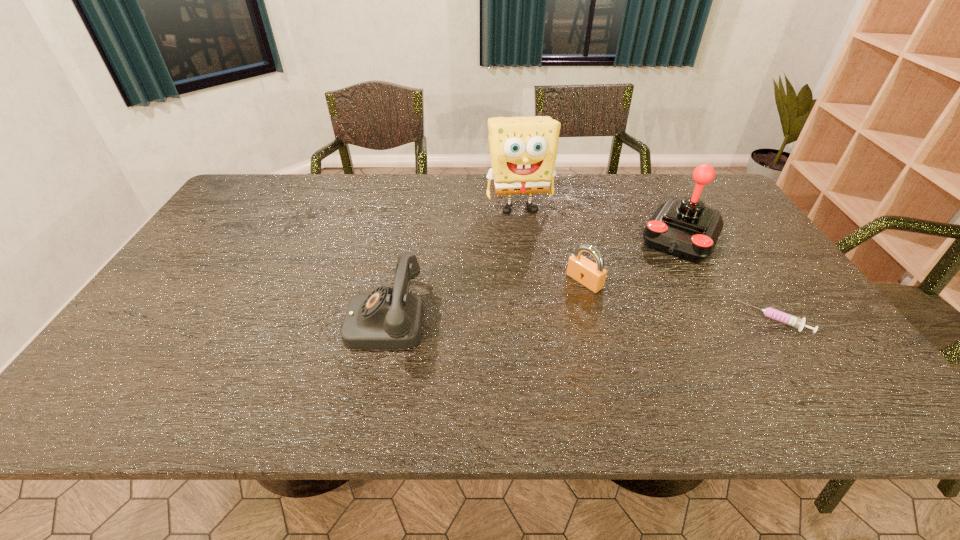
Locate an element on the screen. This screenshot has width=960, height=540. blank space located on the face of the tallest object is located at coordinates (545, 298).

What are the coordinates of `vacant area situated 0.330m on the face of the tallest object` in the screenshot? It's located at (544, 295).

You are a GUI agent. You are given a task and a screenshot of the screen. Output one action in this format:
    pyautogui.click(x=<x>, y=<y>)
    Task: Click on the vacant space located 0.070m on the face of the tallest object
    This screenshot has height=540, width=960.
    Given the screenshot: What is the action you would take?
    528,235

Locate an element on the screen. vacant point located 0.380m on the base of the joystick is located at coordinates (621, 348).

This screenshot has width=960, height=540. Find the location of `vacant area situated 0.220m on the base of the joystick`. vacant area situated 0.220m on the base of the joystick is located at coordinates (643, 307).

The image size is (960, 540). I want to click on vacant space located 0.080m on the base of the joystick, so click(660, 276).

Find the location of a particular element. Image resolution: width=960 pixels, height=540 pixels. vacant space situated 0.160m to unlock the padlock from the front is located at coordinates (531, 319).

I want to click on blank area located to unlock the padlock from the front, so click(501, 340).

The image size is (960, 540). In order to click on blank space located to unlock the padlock from the front in this screenshot , I will do `click(553, 303)`.

Locate an element on the screen. This screenshot has height=540, width=960. sponge present at the far edge is located at coordinates (523, 150).